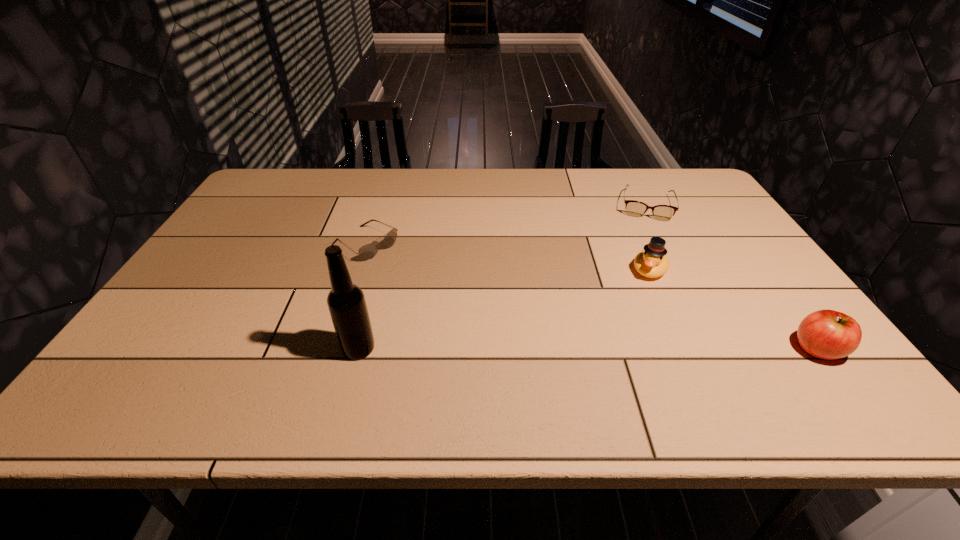
Find the location of `beer bottle`. beer bottle is located at coordinates (347, 306).

Where is `apple`? apple is located at coordinates (827, 334).

At what (x,y) coordinates should I click in order to perform the action: click on sunglasses. Please return your answer as a coordinate pair (x, y). The image size is (960, 540). Looking at the image, I should click on (368, 251).

I want to click on the farthest object, so click(x=634, y=208).

Find the location of a particular element. The height and width of the screenshot is (540, 960). duck is located at coordinates (652, 262).

I want to click on blank area located on the back of the beer bottle, so click(371, 306).

The width and height of the screenshot is (960, 540). Identify the location of vacant space located on the left of the rightmost object. (663, 349).

You are a GUI agent. You are given a task and a screenshot of the screen. Output one action in this format:
    pyautogui.click(x=<x>, y=<y>)
    Task: Click on the free space located on the front-facing side of the sunglasses
    
    Given the screenshot: What is the action you would take?
    pyautogui.click(x=425, y=279)

Where is `vacant space located 0.240m on the front-facing side of the sunglasses`? The width and height of the screenshot is (960, 540). vacant space located 0.240m on the front-facing side of the sunglasses is located at coordinates (450, 294).

This screenshot has height=540, width=960. Identify the location of free space located on the front-facing side of the sunglasses. (422, 278).